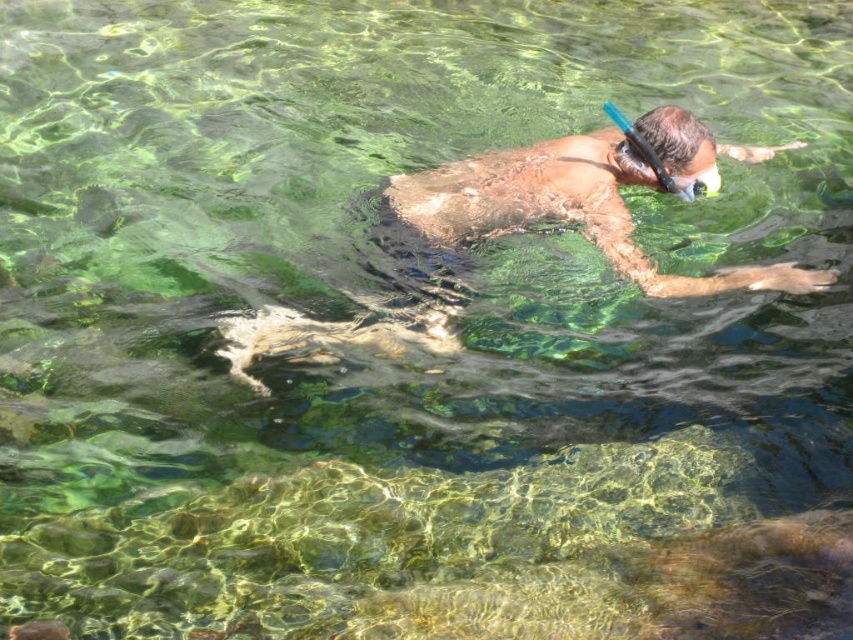
Question: Is smooth skin diver at center positioned at the back of blue rubber snorkel at upper center?

Choices:
 (A) no
 (B) yes

Answer: (A)

Question: Is smooth skin diver at center further to the viewer compared to blue rubber snorkel at upper center?

Choices:
 (A) yes
 (B) no

Answer: (B)

Question: Can you confirm if smooth skin diver at center is positioned below blue rubber snorkel at upper center?

Choices:
 (A) yes
 (B) no

Answer: (A)